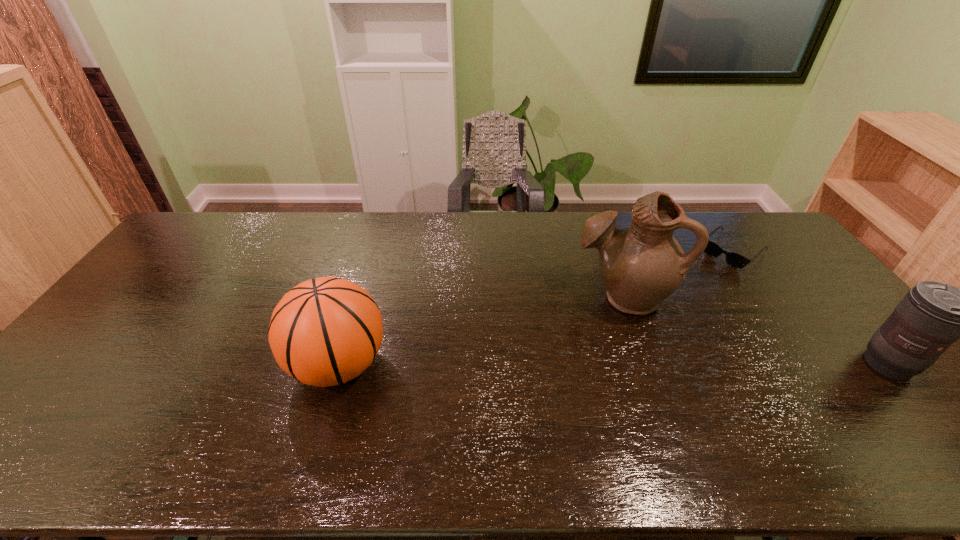
This screenshot has height=540, width=960. Find the location of `the leftmost object`. the leftmost object is located at coordinates (325, 331).

Image resolution: width=960 pixels, height=540 pixels. Identify the location of telephoto lens. (932, 315).

Image resolution: width=960 pixels, height=540 pixels. I want to click on the second object from right to left, so click(733, 259).

I want to click on the shortest object, so click(x=733, y=259).

Where is `the second object from left to right`? This screenshot has width=960, height=540. the second object from left to right is located at coordinates (642, 265).

Identify the location of the tallest object. The height and width of the screenshot is (540, 960). (642, 265).

The height and width of the screenshot is (540, 960). I want to click on vacant space located on the right of the basketball, so click(515, 365).

Find the location of `free space located 0.210m at the front lenses of the second object from right to left`. free space located 0.210m at the front lenses of the second object from right to left is located at coordinates (684, 294).

This screenshot has width=960, height=540. What are the coordinates of `vacant region located 0.250m at the front lenses of the second object from right to left` in the screenshot? It's located at (677, 300).

The image size is (960, 540). Identify the location of vacant space located 0.300m at the front lenses of the second object from right to left. (668, 307).